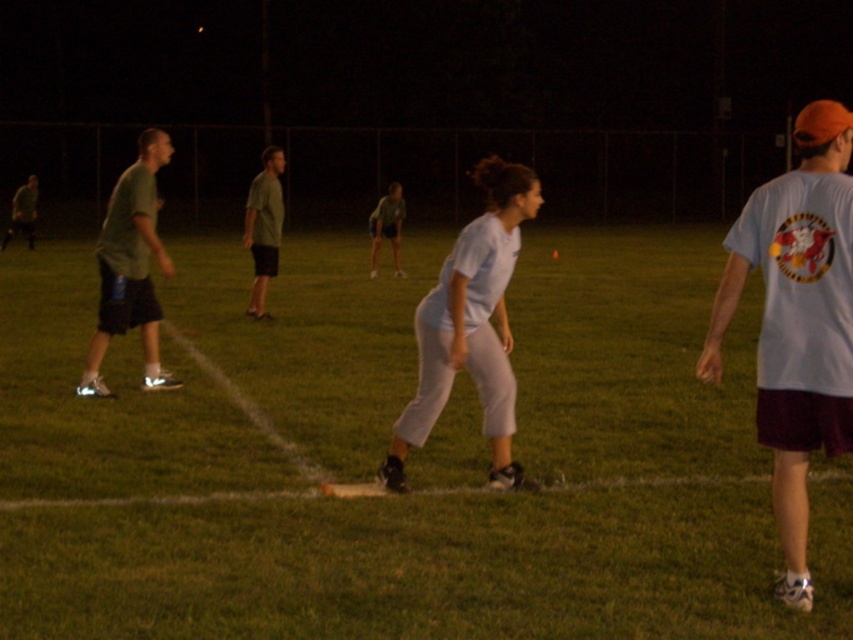
Question: Which of these objects is positioned closest to the matte green shirt at left?

Choices:
 (A) light blue fabric shorts at center
 (B) green matte shirt at left
 (C) matte green shirt at center
 (D) white matte t-shirt at right

Answer: (C)

Question: Estimate the real-world distances between objects in this image. Which object is closer to the green matte shirt at left?

Choices:
 (A) matte green shirt at center
 (B) light blue fabric shorts at center

Answer: (B)

Question: Is white matte t-shirt at right closer to the viewer compared to light blue fabric shorts at center?

Choices:
 (A) yes
 (B) no

Answer: (A)

Question: Which of the following is the closest to the observer?

Choices:
 (A) (372, 230)
 (B) (252, 314)

Answer: (B)

Question: Is matte green shirt at left to the right of light blue fabric shorts at center from the viewer's perspective?

Choices:
 (A) no
 (B) yes

Answer: (A)

Question: Can you confirm if green grass football field at center is positioned to the left of matte green shirt at left?

Choices:
 (A) no
 (B) yes

Answer: (A)